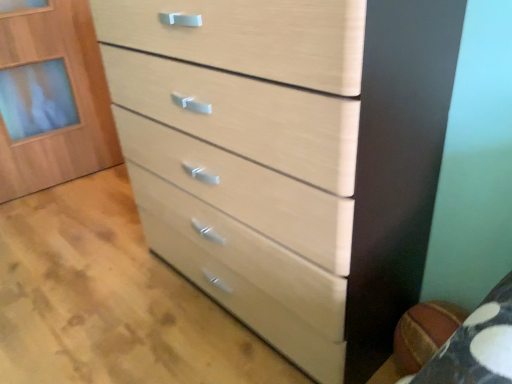
Locate an element on the screen. space that is in front of light wood cabinet at upper left is located at coordinates (56, 212).